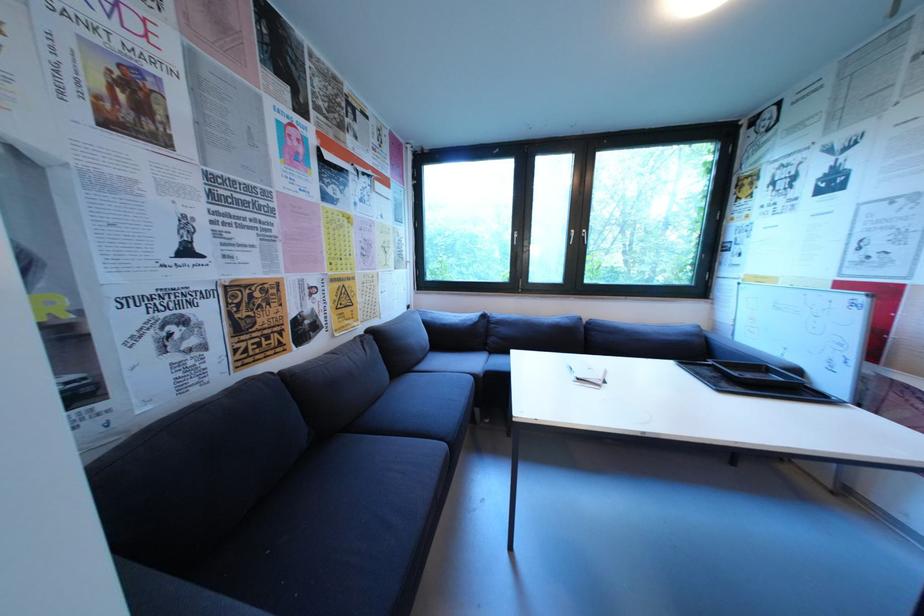
Describe the element at coordinates (368, 493) in the screenshot. I see `the dark sofa sitting surface` at that location.